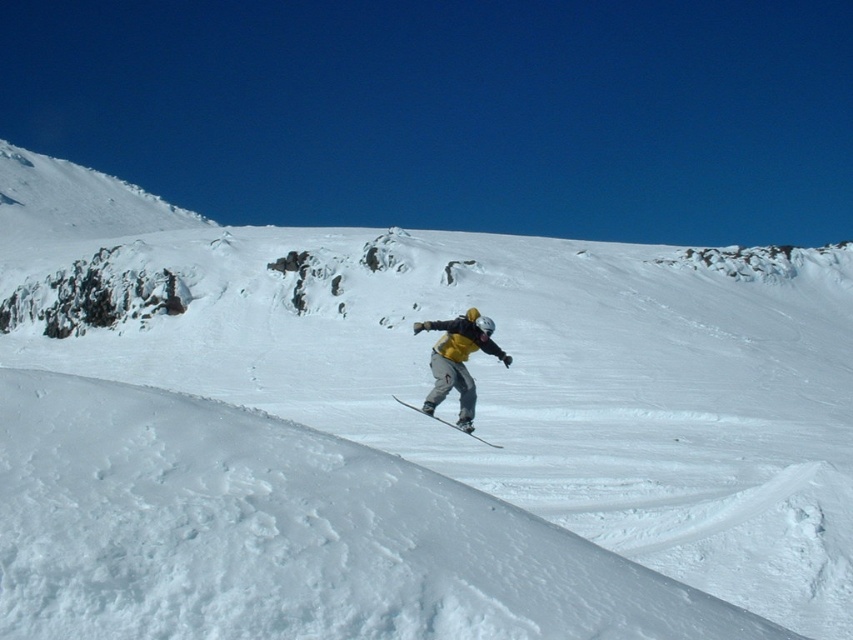
Between yellow fabric snowboarder at center and metallic gray ski at center, which one has less height?

metallic gray ski at center is shorter.

Measure the distance between yellow fabric snowboarder at center and metallic gray ski at center.

The distance of yellow fabric snowboarder at center from metallic gray ski at center is 4.20 feet.

Between point (440, 356) and point (418, 408), which one is positioned behind?

The point (418, 408) is behind.

Find the location of `yellow fabric snowboarder at center`. yellow fabric snowboarder at center is located at coordinates (457, 364).